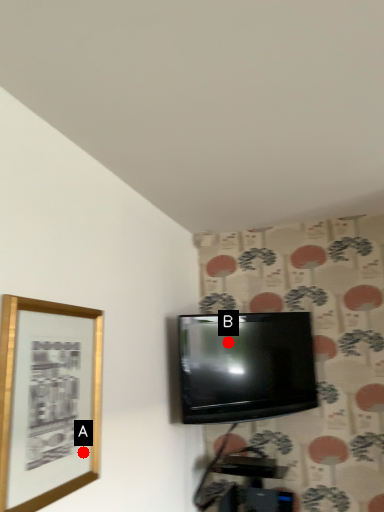
Question: Two points are circled on the image, labeled by A and B beside each circle. Which of the following is the farthest from the observer?

Choices:
 (A) A is further
 (B) B is further

Answer: (B)